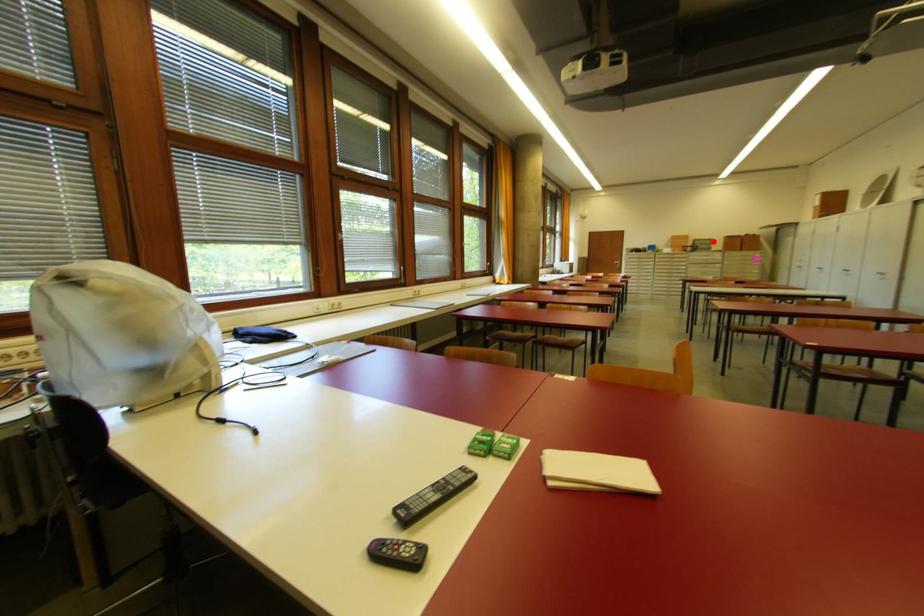
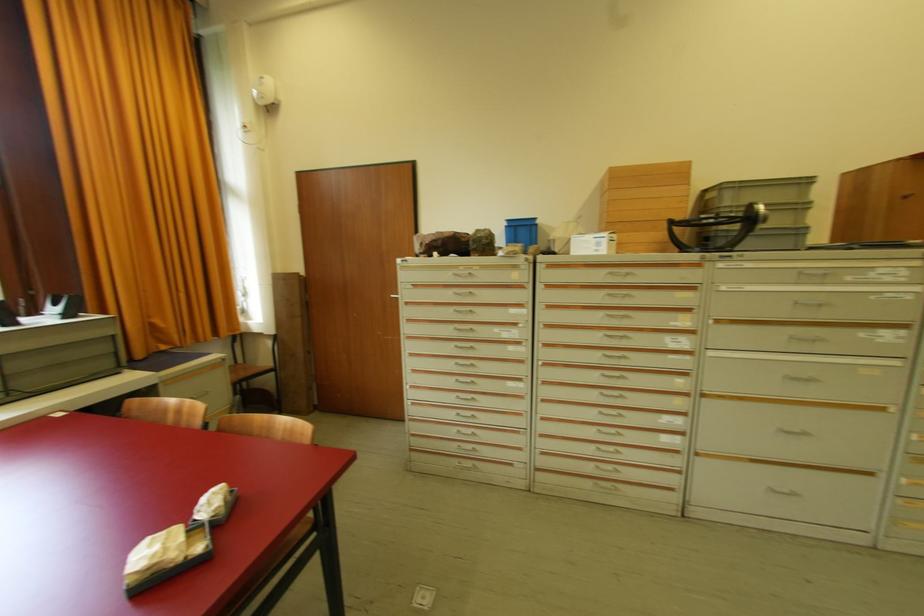
Question: I am providing you with two images of the same scene from different viewpoints. A red point is shown in image1. For the corresponding object point in image2, is it positioned nearer or farther from the camera?

Choices:
 (A) Nearer
 (B) Farther

Answer: (B)